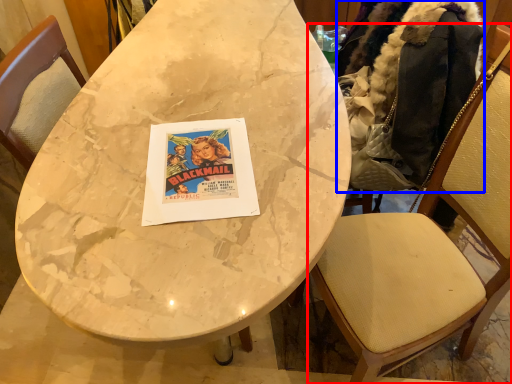
Question: Which object appears farthest to the camera in this image, chair (highlighted by a red box) or jacket (highlighted by a blue box)?

Choices:
 (A) chair
 (B) jacket

Answer: (B)